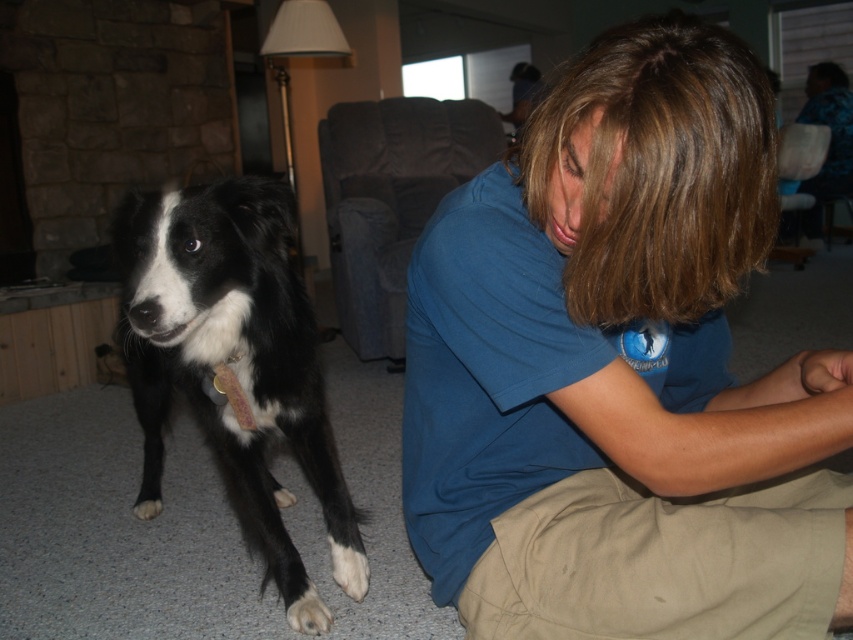
Is the position of blue cotton shirt at lower right less distant than that of black and white fur at left?

Yes, blue cotton shirt at lower right is closer to the viewer.

Does point (424, 260) come in front of point (138, 200)?

Yes, point (424, 260) is in front of point (138, 200).

Between point (653, 625) and point (218, 188), which one is positioned in front?

Point (653, 625) is in front.

Identify the location of blue cotton shirt at lower right. The width and height of the screenshot is (853, 640). (621, 369).

Is blue cotton shirt at lower right taller than white fur at lower left?

Indeed, blue cotton shirt at lower right has a greater height compared to white fur at lower left.

Is blue cotton shirt at lower right wider than white fur at lower left?

Indeed, blue cotton shirt at lower right has a greater width compared to white fur at lower left.

Image resolution: width=853 pixels, height=640 pixels. Describe the element at coordinates (621, 369) in the screenshot. I see `blue cotton shirt at lower right` at that location.

At what (x,y) coordinates should I click in order to perform the action: click on blue cotton shirt at lower right. Please return your answer as a coordinate pair (x, y). The image size is (853, 640). Looking at the image, I should click on (621, 369).

Between point (173, 305) and point (358, 561), which one is positioned in front?

Positioned in front is point (173, 305).

Can you confirm if black and white fur at left is positioned to the right of white fur at lower left?

In fact, black and white fur at left is to the left of white fur at lower left.

Where is `black and white fur at left`? This screenshot has height=640, width=853. black and white fur at left is located at coordinates coord(230,360).